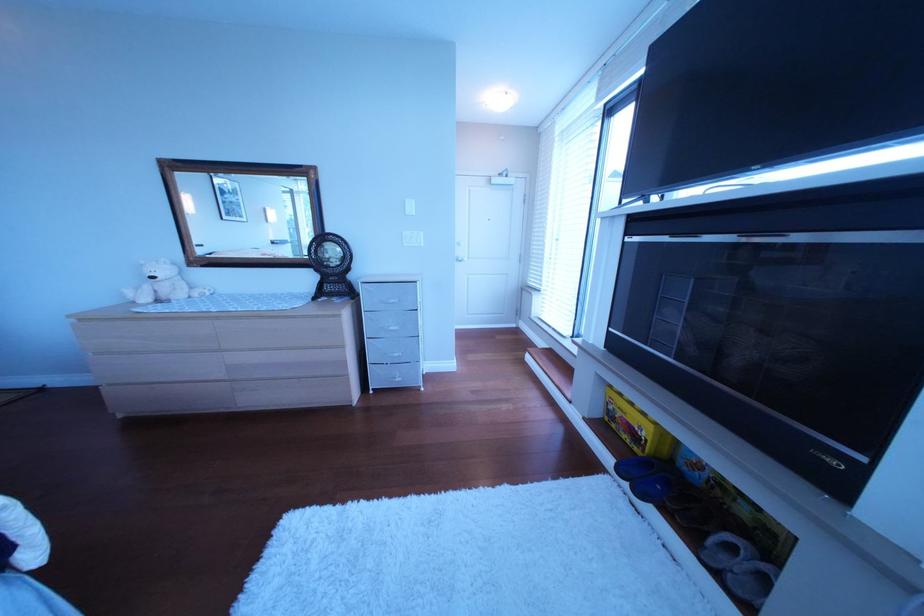
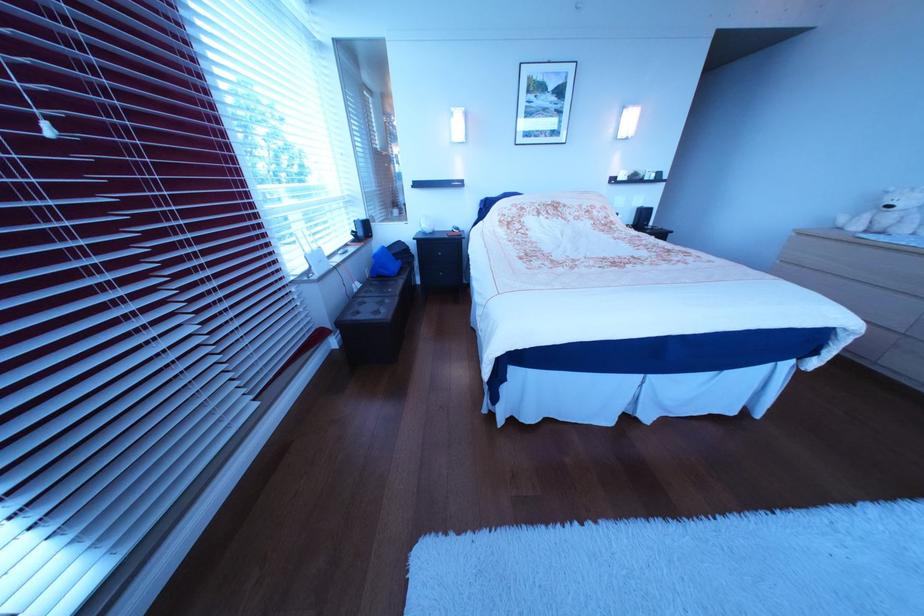
Where in the second image is the point corresponding to (168,280) from the first image?

(906, 209)